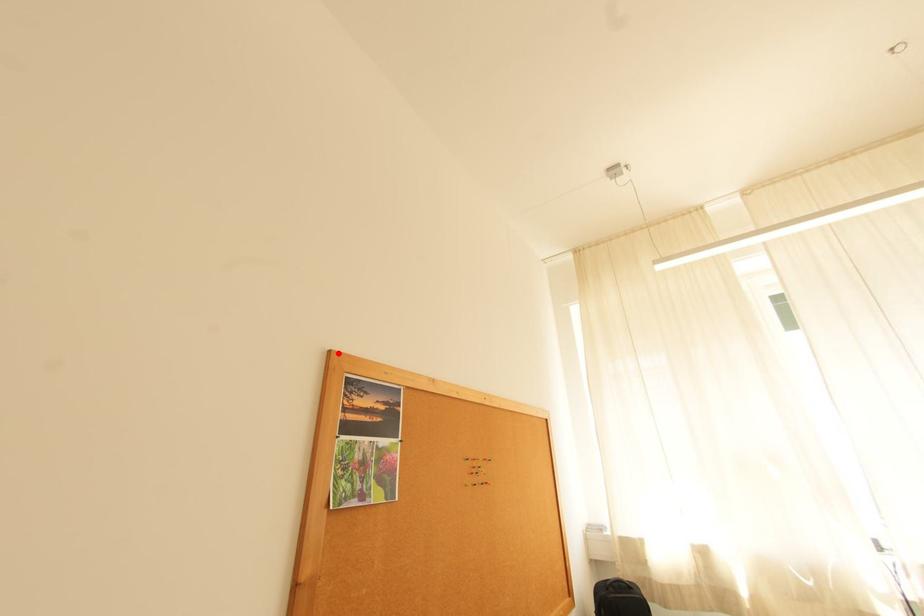
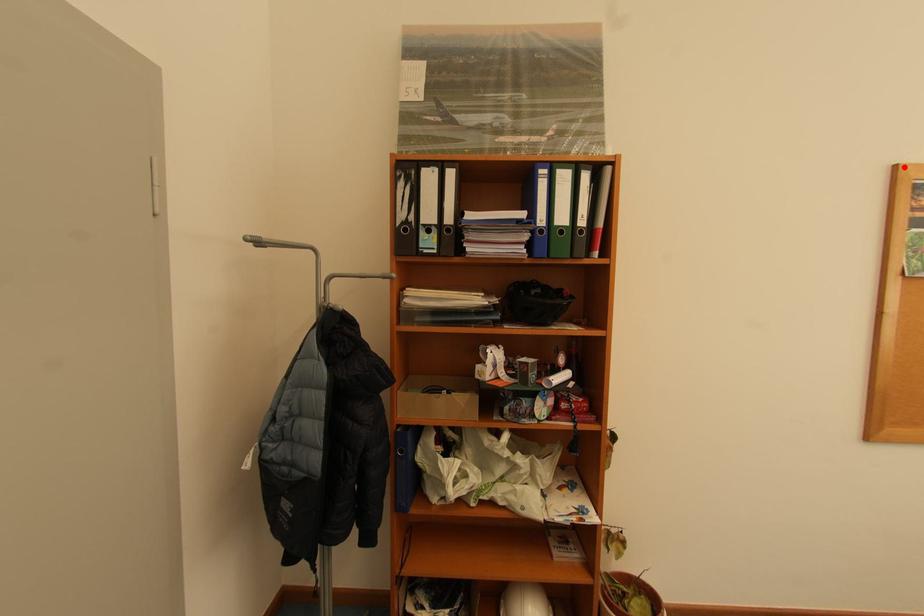
I am providing you with two images of the same scene from different viewpoints. A red point is marked on the first image and another point is marked on the second image. Does the point marked in image1 correspond to the same location as the one in image2?

Yes